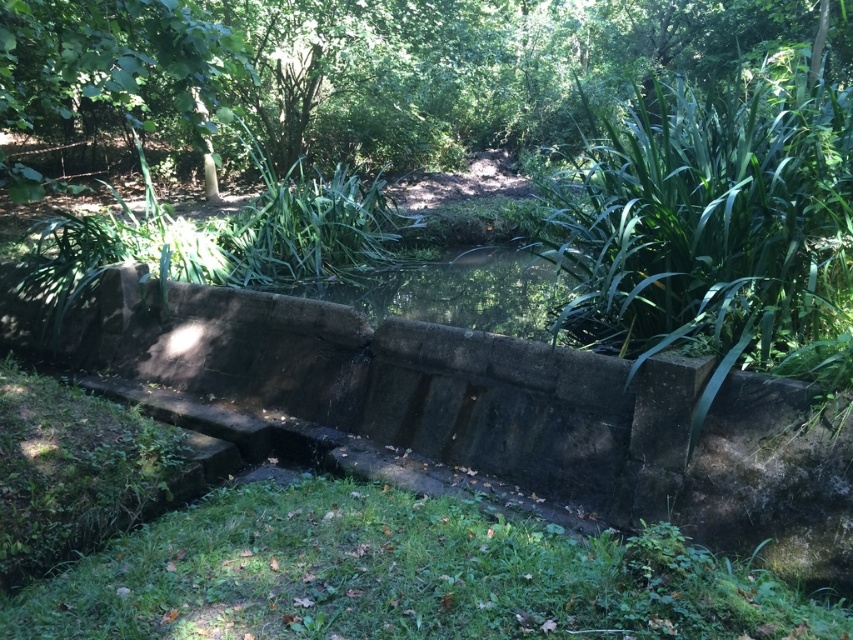
Consider the image. You are a landscape architect designing a new garden. You want to place a small bench between the green leafy tree at upper center and the green grassy patch at lower center. Which object should the bench be closer to if you want it to be proportionally balanced with their sizes?

The bench should be closer to the green grassy patch at lower center because the green leafy tree at upper center is wider, so placing the bench closer to the smaller green grassy patch helps balance the composition.

You are standing at point (279, 513) and want to walk to the water feature. Is point (740, 16) behind you or in front of you as you face the water feature?

Point (740, 16) is behind point (279, 513), so when facing the water feature, point (740, 16) would be behind you.